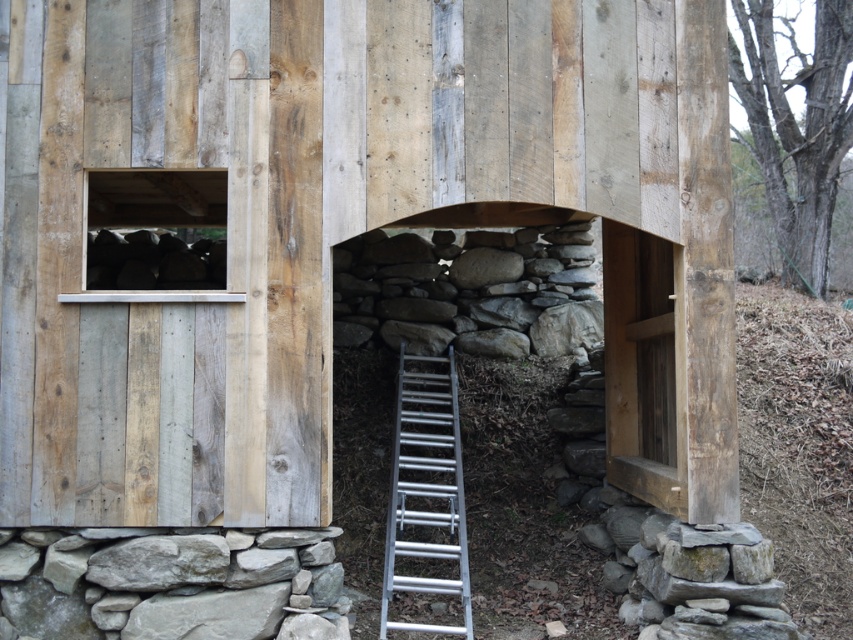
Does point (631, 477) come in front of point (412, 397)?

Yes, point (631, 477) is closer to viewer.

Who is more distant from viewer, (451, 28) or (456, 456)?

The point (456, 456) is more distant.

Between point (97, 417) and point (401, 432), which one is positioned in front?

Positioned in front is point (97, 417).

You are a GUI agent. You are given a task and a screenshot of the screen. Output one action in this format:
    pyautogui.click(x=<x>, y=<y>)
    Task: Click on the weathered wood barn at center
    
    Given the screenshot: What is the action you would take?
    (345, 230)